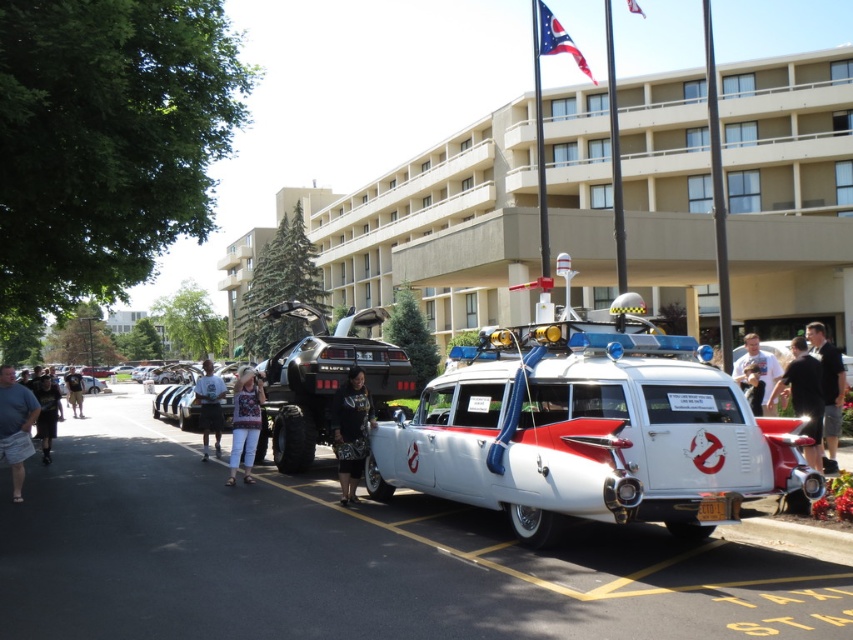
Question: Based on their relative distances, which object is farther from the dark blue denim jacket at center?

Choices:
 (A) white cotton shirt at center
 (B) beige concrete building at center
 (C) blue denim shorts at left
 (D) black fabric shirt at right

Answer: (B)

Question: Is the position of white glossy car at center more distant than that of black leather jacket at lower right?

Choices:
 (A) yes
 (B) no

Answer: (B)

Question: Which object is positioned farthest from the white t-shirt at center?

Choices:
 (A) denim pants at center
 (B) blue denim shorts at left
 (C) white cotton shirt at center

Answer: (C)

Question: Where is denim pants at center located in relation to dark gray fabric shirt at left in the image?

Choices:
 (A) right
 (B) left

Answer: (A)

Question: Is blue denim shorts at left smaller than khaki shorts at center?

Choices:
 (A) yes
 (B) no

Answer: (A)

Question: Which point is farther to the camera?

Choices:
 (A) (837, 138)
 (B) (486, 360)
 (C) (824, 435)
 (D) (54, 413)

Answer: (A)